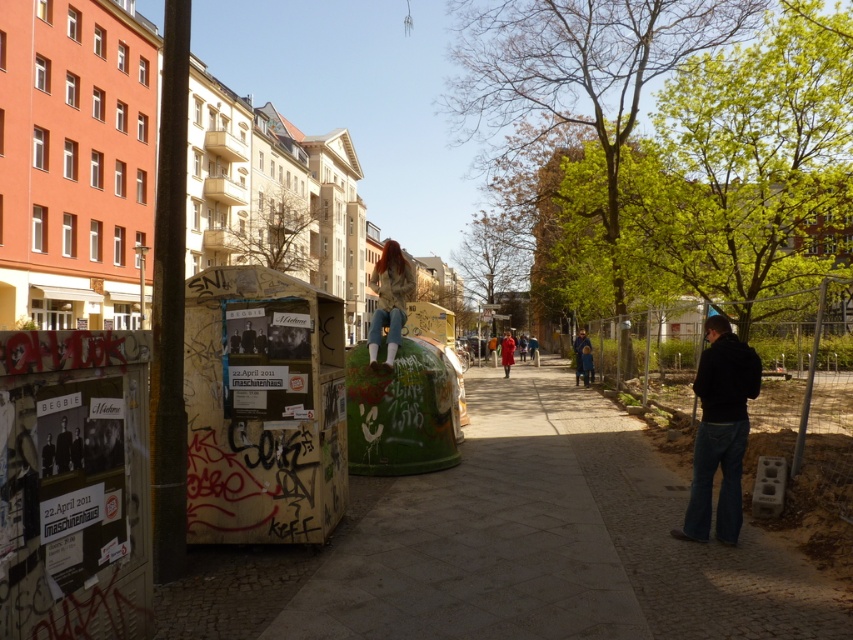
Question: Does light brown leather jacket at center appear on the right side of blue denim jeans at center?

Choices:
 (A) yes
 (B) no

Answer: (B)

Question: Among these objects, which one is farthest from the camera?

Choices:
 (A) red fabric coat at center
 (B) light brown leather jacket at center
 (C) black cotton hoodie at lower right
 (D) blue denim jeans at center

Answer: (A)

Question: Where is black cotton hoodie at lower right located in relation to light brown leather jacket at center in the image?

Choices:
 (A) below
 (B) above

Answer: (A)

Question: Which point is closer to the camera?

Choices:
 (A) (714, 385)
 (B) (405, 316)

Answer: (A)

Question: Is the position of light brown leather jacket at center more distant than that of blue denim jeans at center?

Choices:
 (A) yes
 (B) no

Answer: (B)

Question: Which of the following is the farthest from the observer?

Choices:
 (A) (508, 365)
 (B) (576, 346)

Answer: (A)